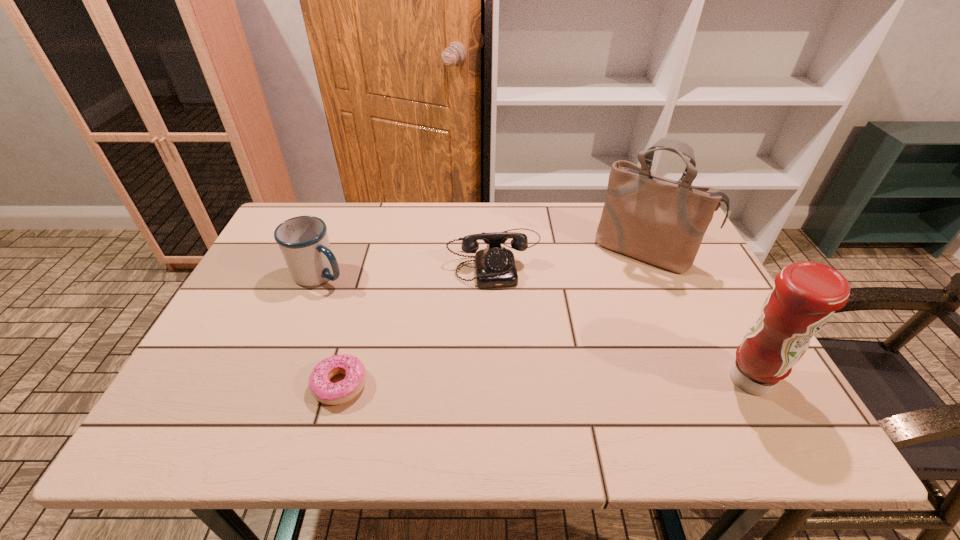
Where is `vacant area that lies between the second tallest object and the mug`? vacant area that lies between the second tallest object and the mug is located at coordinates (535, 327).

The width and height of the screenshot is (960, 540). I want to click on unoccupied position between the second tallest object and the doughnut, so click(x=545, y=382).

Identify the location of object identified as the fourth closest to the mug. This screenshot has width=960, height=540. (806, 295).

Select which object is the third closest to the telephone. Please provide its 2D coordinates. Your answer should be formatted as a tuple, i.e. [(x, y)], where the tuple contains the x and y coordinates of a point satisfying the conditions above.

[(321, 388)]

Where is `vacant position in the image that satisfies the following two spatial constraints: 1. on the front side of the condiment; 2. on the right side of the fourth tallest object`? Image resolution: width=960 pixels, height=540 pixels. vacant position in the image that satisfies the following two spatial constraints: 1. on the front side of the condiment; 2. on the right side of the fourth tallest object is located at coordinates (500, 380).

Find the location of `free spot that satisfies the following two spatial constraints: 1. on the front side of the doughnut; 2. on the right side of the leftmost object`. free spot that satisfies the following two spatial constraints: 1. on the front side of the doughnut; 2. on the right side of the leftmost object is located at coordinates (276, 385).

Identify the location of vacant space that satisfies the following two spatial constraints: 1. on the back side of the tallest object; 2. on the right side of the second object from left to right. This screenshot has height=540, width=960. (377, 251).

This screenshot has width=960, height=540. I want to click on vacant region that satisfies the following two spatial constraints: 1. on the back side of the fourth object from right to left; 2. on the left side of the telephone, so click(375, 256).

Find the location of a particular element. free point that satisfies the following two spatial constraints: 1. on the front side of the shoulder bag; 2. on the left side of the condiment is located at coordinates (703, 380).

Where is `free space that satisfies the following two spatial constraints: 1. on the back side of the doughnut; 2. on the right side of the fourth tallest object`? This screenshot has width=960, height=540. free space that satisfies the following two spatial constraints: 1. on the back side of the doughnut; 2. on the right side of the fourth tallest object is located at coordinates (375, 256).